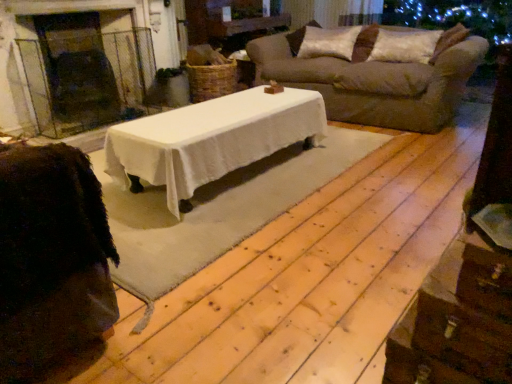
Where is `brown fabric sofa at upper right`? brown fabric sofa at upper right is located at coordinates (375, 83).

Find the location of a particular element. This screenshot has height=384, width=512. velvet brown pillow at upper right, the second pillow from the left is located at coordinates (405, 46).

Describe the element at coordinates (83, 67) in the screenshot. I see `glass fireplace at left` at that location.

You are a GUI agent. You are given a task and a screenshot of the screen. Output one action in this format:
    pyautogui.click(x=<x>, y=<y>)
    Task: Click on the silky beige pillow at upper right, the first pillow when ordered from left to right
    The height and width of the screenshot is (384, 512).
    Given the screenshot: What is the action you would take?
    pyautogui.click(x=327, y=42)

Would you say silky beige pillow at upper right, the first pillow when ordered from left to right, is outside brown fabric sofa at upper right?

No, silky beige pillow at upper right, the first pillow when ordered from left to right, is not entirely external to brown fabric sofa at upper right.

From the image's perspective, is silky beige pillow at upper right, which is counted as the 2th pillow, starting from the right, positioned above or below brown fabric sofa at upper right?

silky beige pillow at upper right, which is counted as the 2th pillow, starting from the right, is above brown fabric sofa at upper right.

Is silky beige pillow at upper right, which is counted as the 2th pillow, starting from the right, not close to brown fabric sofa at upper right?

No, silky beige pillow at upper right, which is counted as the 2th pillow, starting from the right, is not far from brown fabric sofa at upper right.

Locate an element on the screen. The image size is (512, 384). studio sofa in front of the silky beige pillow at upper right, which is counted as the 2th pillow, starting from the right is located at coordinates (375, 83).

Considering the relative positions of glass fireplace at left and velvet brown pillow at upper right, which is the first pillow in right-to-left order, in the image provided, is glass fireplace at left to the left or to the right of velvet brown pillow at upper right, which is the first pillow in right-to-left order,?

glass fireplace at left is positioned on velvet brown pillow at upper right, which is the first pillow in right-to-left order,'s left side.

From a real-world perspective, is glass fireplace at left below velvet brown pillow at upper right, the second pillow from the left?

Yes, from a real-world perspective, glass fireplace at left is under velvet brown pillow at upper right, the second pillow from the left.

The image size is (512, 384). I want to click on fireplace to the left of velvet brown pillow at upper right, which is the first pillow in right-to-left order, so click(83, 67).

Looking at the image, does glass fireplace at left seem bigger or smaller compared to velvet brown pillow at upper right, the second pillow from the left?

In the image, glass fireplace at left appears to be larger than velvet brown pillow at upper right, the second pillow from the left.

Is brown fabric sofa at upper right inside velvet brown pillow at upper right, which is the first pillow in right-to-left order?

No, brown fabric sofa at upper right is not inside velvet brown pillow at upper right, which is the first pillow in right-to-left order.

In the scene shown: Considering the sizes of objects velvet brown pillow at upper right, the second pillow from the left, and brown fabric sofa at upper right in the image provided, who is wider, velvet brown pillow at upper right, the second pillow from the left, or brown fabric sofa at upper right?

brown fabric sofa at upper right is wider.

Is velvet brown pillow at upper right, which is the first pillow in right-to-left order, at the left side of brown fabric sofa at upper right?

In fact, velvet brown pillow at upper right, which is the first pillow in right-to-left order, is to the right of brown fabric sofa at upper right.

Is point (399, 46) more distant than point (406, 82)?

Yes, point (399, 46) is farther from viewer.

Relative to glass fireplace at left, is silky beige pillow at upper right, which is counted as the 2th pillow, starting from the right, in front or behind?

In the image, silky beige pillow at upper right, which is counted as the 2th pillow, starting from the right, appears behind glass fireplace at left.

From the image's perspective, does silky beige pillow at upper right, the first pillow when ordered from left to right, appear lower than glass fireplace at left?

No, from the image's perspective, silky beige pillow at upper right, the first pillow when ordered from left to right, is not beneath glass fireplace at left.

Which of these two, silky beige pillow at upper right, which is counted as the 2th pillow, starting from the right, or glass fireplace at left, is wider?

Wider between the two is glass fireplace at left.

From the image's perspective, is brown fabric sofa at upper right located beneath silky beige pillow at upper right, the first pillow when ordered from left to right?

Yes, from the image's perspective, brown fabric sofa at upper right is below silky beige pillow at upper right, the first pillow when ordered from left to right.

Consider the image. Can you tell me how much brown fabric sofa at upper right and silky beige pillow at upper right, which is counted as the 2th pillow, starting from the right, differ in facing direction?

0.000106 degrees.

Considering the points (454, 86) and (303, 57), which point is in front, point (454, 86) or point (303, 57)?

Point (454, 86)

At what (x,y) coordinates should I click in order to perform the action: click on studio sofa below the silky beige pillow at upper right, which is counted as the 2th pillow, starting from the right (from the image's perspective). Please return your answer as a coordinate pair (x, y). The width and height of the screenshot is (512, 384). Looking at the image, I should click on (375, 83).

Are silky beige pillow at upper right, the first pillow when ordered from left to right, and velvet brown pillow at upper right, which is the first pillow in right-to-left order, beside each other?

No, silky beige pillow at upper right, the first pillow when ordered from left to right, is not next to velvet brown pillow at upper right, which is the first pillow in right-to-left order.

Can velvet brown pillow at upper right, the second pillow from the left, be found inside silky beige pillow at upper right, the first pillow when ordered from left to right?

No, velvet brown pillow at upper right, the second pillow from the left, is not inside silky beige pillow at upper right, the first pillow when ordered from left to right.

In the scene shown: Is silky beige pillow at upper right, which is counted as the 2th pillow, starting from the right, to the left or to the right of velvet brown pillow at upper right, the second pillow from the left, in the image?

silky beige pillow at upper right, which is counted as the 2th pillow, starting from the right, is positioned on velvet brown pillow at upper right, the second pillow from the left,'s left side.

Who is smaller, silky beige pillow at upper right, which is counted as the 2th pillow, starting from the right, or velvet brown pillow at upper right, the second pillow from the left?

With smaller size is velvet brown pillow at upper right, the second pillow from the left.

In the scene shown: Which is farther, (108,34) or (298,52)?

The point (298,52) is behind.

Consider the image. From the image's perspective, would you say glass fireplace at left is positioned over silky beige pillow at upper right, the first pillow when ordered from left to right?

No, from the image's perspective, glass fireplace at left is not over silky beige pillow at upper right, the first pillow when ordered from left to right.

Considering the relative positions of glass fireplace at left and silky beige pillow at upper right, which is counted as the 2th pillow, starting from the right, in the image provided, is glass fireplace at left to the left of silky beige pillow at upper right, which is counted as the 2th pillow, starting from the right, from the viewer's perspective?

Indeed, glass fireplace at left is positioned on the left side of silky beige pillow at upper right, which is counted as the 2th pillow, starting from the right.

Looking at this image, are glass fireplace at left and silky beige pillow at upper right, the first pillow when ordered from left to right, beside each other?

No, glass fireplace at left is not next to silky beige pillow at upper right, the first pillow when ordered from left to right.

From a real-world perspective, which pillow is the 1st one above the brown fabric sofa at upper right? Please provide its 2D coordinates.

[(327, 42)]

Where is `fireplace located underneath the velvet brown pillow at upper right, the second pillow from the left (from a real-world perspective)`? The image size is (512, 384). fireplace located underneath the velvet brown pillow at upper right, the second pillow from the left (from a real-world perspective) is located at coordinates (83, 67).

Which object lies nearer to the anchor point silky beige pillow at upper right, which is counted as the 2th pillow, starting from the right, glass fireplace at left or brown fabric sofa at upper right?

The object closer to silky beige pillow at upper right, which is counted as the 2th pillow, starting from the right, is brown fabric sofa at upper right.

In the scene shown: Which object lies nearer to the anchor point glass fireplace at left, velvet brown pillow at upper right, the second pillow from the left, or brown fabric sofa at upper right?

brown fabric sofa at upper right lies closer to glass fireplace at left than the other object.

Based on their spatial positions, is velvet brown pillow at upper right, the second pillow from the left, or glass fireplace at left further from brown fabric sofa at upper right?

glass fireplace at left is positioned further to the anchor brown fabric sofa at upper right.

Looking at the image, which one is located closer to velvet brown pillow at upper right, the second pillow from the left, glass fireplace at left or brown fabric sofa at upper right?

brown fabric sofa at upper right is closer to velvet brown pillow at upper right, the second pillow from the left.

In the scene shown: Looking at the image, which one is located further to brown fabric sofa at upper right, silky beige pillow at upper right, the first pillow when ordered from left to right, or glass fireplace at left?

The object further to brown fabric sofa at upper right is glass fireplace at left.

From the image, which object appears to be farther from silky beige pillow at upper right, the first pillow when ordered from left to right, brown fabric sofa at upper right or glass fireplace at left?

Based on the image, glass fireplace at left appears to be further to silky beige pillow at upper right, the first pillow when ordered from left to right.

Looking at the image, which one is located further to velvet brown pillow at upper right, the second pillow from the left, glass fireplace at left or silky beige pillow at upper right, the first pillow when ordered from left to right?

The object further to velvet brown pillow at upper right, the second pillow from the left, is glass fireplace at left.

Based on their spatial positions, is glass fireplace at left or silky beige pillow at upper right, which is counted as the 2th pillow, starting from the right, further from brown fabric sofa at upper right?

glass fireplace at left.

Locate an element on the screen. Image resolution: width=512 pixels, height=384 pixels. pillow between brown fabric sofa at upper right and silky beige pillow at upper right, the first pillow when ordered from left to right, from front to back is located at coordinates (405, 46).

Identify the location of studio sofa situated between glass fireplace at left and velvet brown pillow at upper right, which is the first pillow in right-to-left order, from left to right. (375, 83).

You are a GUI agent. You are given a task and a screenshot of the screen. Output one action in this format:
    pyautogui.click(x=<x>, y=<y>)
    Task: Click on the pillow between glass fireplace at left and brown fabric sofa at upper right
    
    Given the screenshot: What is the action you would take?
    pyautogui.click(x=327, y=42)

The height and width of the screenshot is (384, 512). What are the coordinates of `pillow between glass fireplace at left and velvet brown pillow at upper right, which is the first pillow in right-to-left order, in the horizontal direction` in the screenshot? It's located at (327, 42).